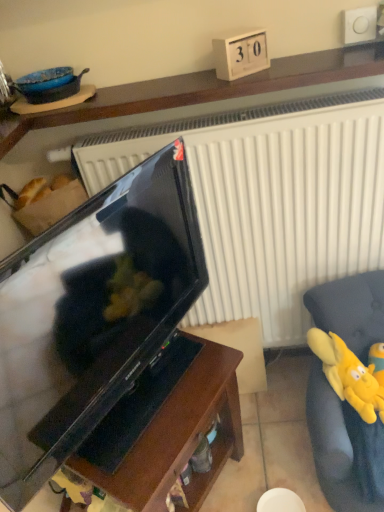
Question: Would you say matte black television at center is inside or outside black glossy tv stand at center, which is the third furniture in top-to-bottom order?

Choices:
 (A) inside
 (B) outside

Answer: (B)

Question: Considering the positions of matte black television at center and black glossy tv stand at center, which is the third furniture in top-to-bottom order, in the image, is matte black television at center taller or shorter than black glossy tv stand at center, which is the third furniture in top-to-bottom order,?

Choices:
 (A) tall
 (B) short

Answer: (A)

Question: Estimate the real-world distances between objects in this image. Which object is farther from the wooden shelf at upper center, which ranks as the 1th furniture in top-to-bottom order?

Choices:
 (A) black glossy tv stand at center, arranged as the 1th furniture when ordered from the bottom
 (B) matte black television at center
 (C) yellow plush toy at right, the second furniture when ordered from top to bottom
 (D) yellow plush toy at right

Answer: (D)

Question: Estimate the real-world distances between objects in this image. Which object is closer to the matte black television at center?

Choices:
 (A) wooden shelf at upper center, which ranks as the 1th furniture in top-to-bottom order
 (B) yellow plush toy at right
 (C) yellow plush toy at right, which is counted as the 2th furniture, starting from the bottom
 (D) black glossy tv stand at center, arranged as the 1th furniture when ordered from the bottom

Answer: (D)